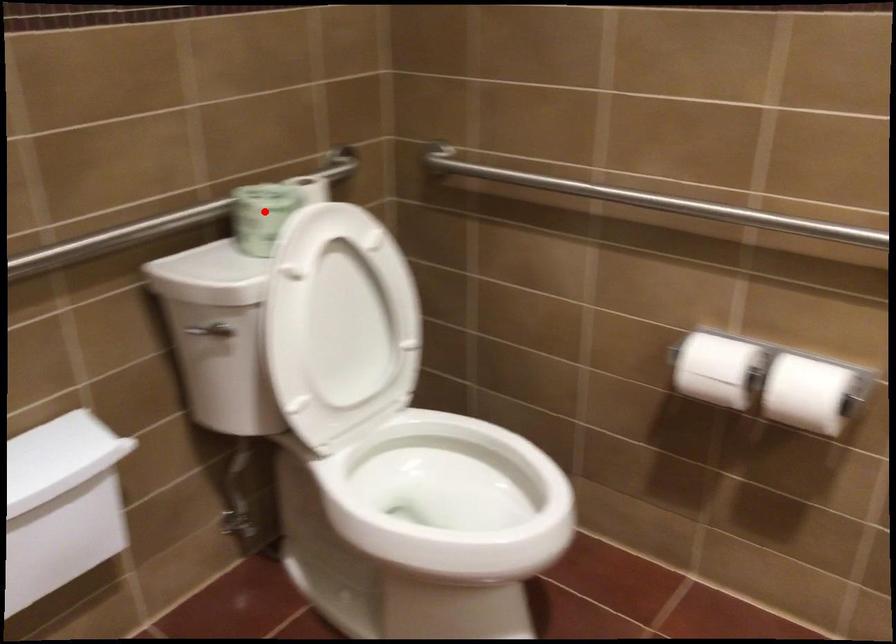
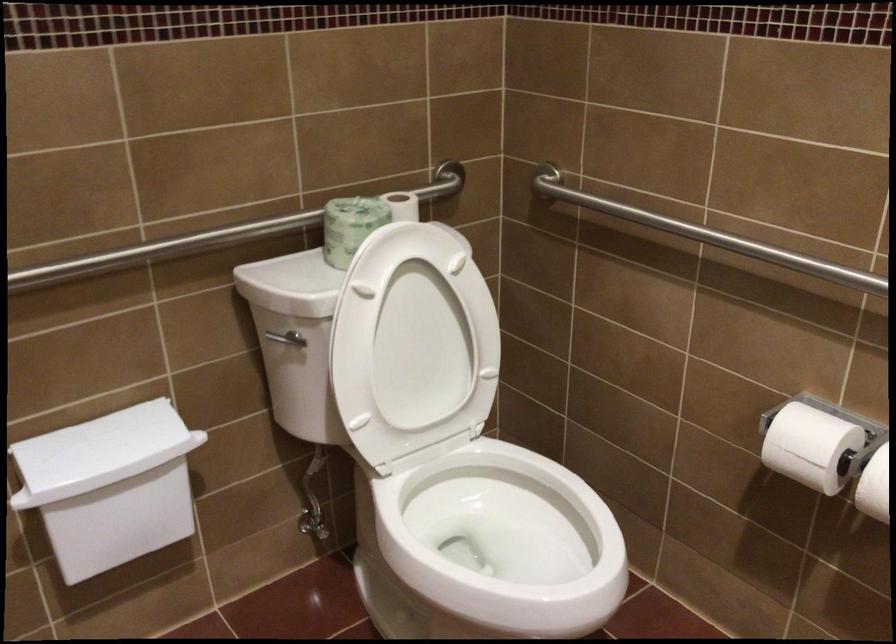
Where in the second image is the point corresponding to the highlighted location from the first image?

(350, 225)